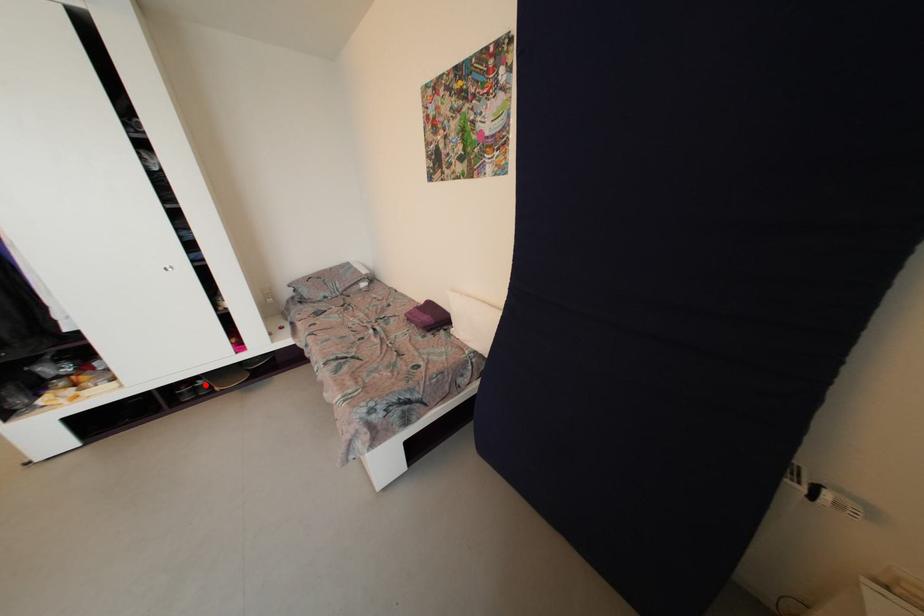
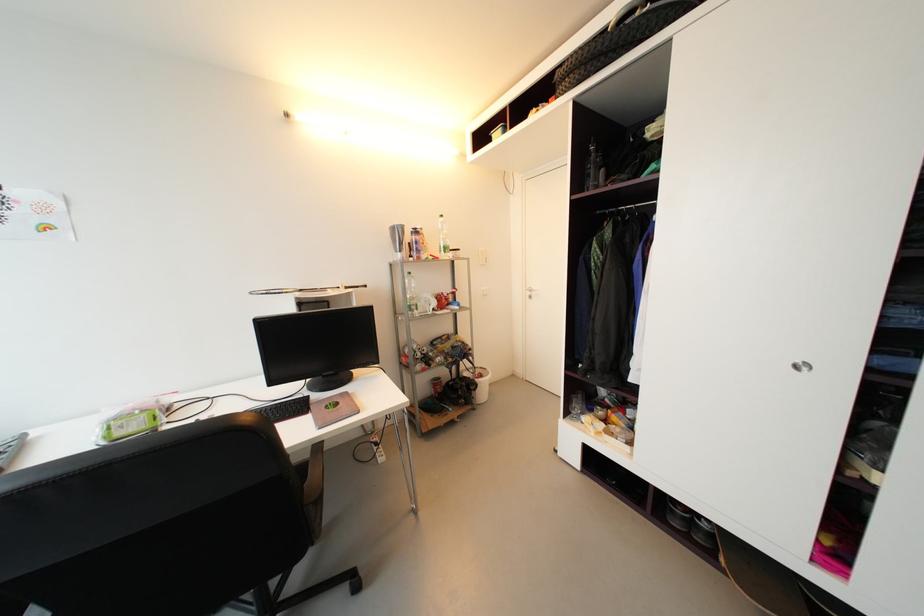
Question: I am providing you with two images of the same scene from different viewpoints. Given a red point in image1, look at the same physical point in image2. Is it:

Choices:
 (A) Closer to the viewpoint
 (B) Farther from the viewpoint

Answer: (B)